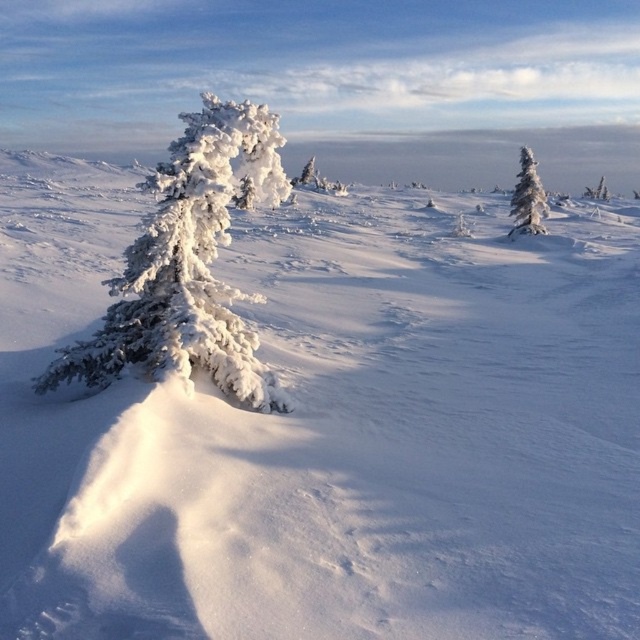
Question: Is white frosty tree at center behind white frosty tree at right?

Choices:
 (A) yes
 (B) no

Answer: (B)

Question: Can you confirm if white frosty tree at center is smaller than white frosty tree at right?

Choices:
 (A) no
 (B) yes

Answer: (B)

Question: Can you confirm if white frosty tree at center is wider than white frosty tree at right?

Choices:
 (A) no
 (B) yes

Answer: (A)

Question: Which point is closer to the camera taking this photo?

Choices:
 (A) (544, 228)
 (B) (209, 109)

Answer: (B)

Question: Among these points, which one is nearest to the camera?

Choices:
 (A) (525, 196)
 (B) (179, 292)

Answer: (B)